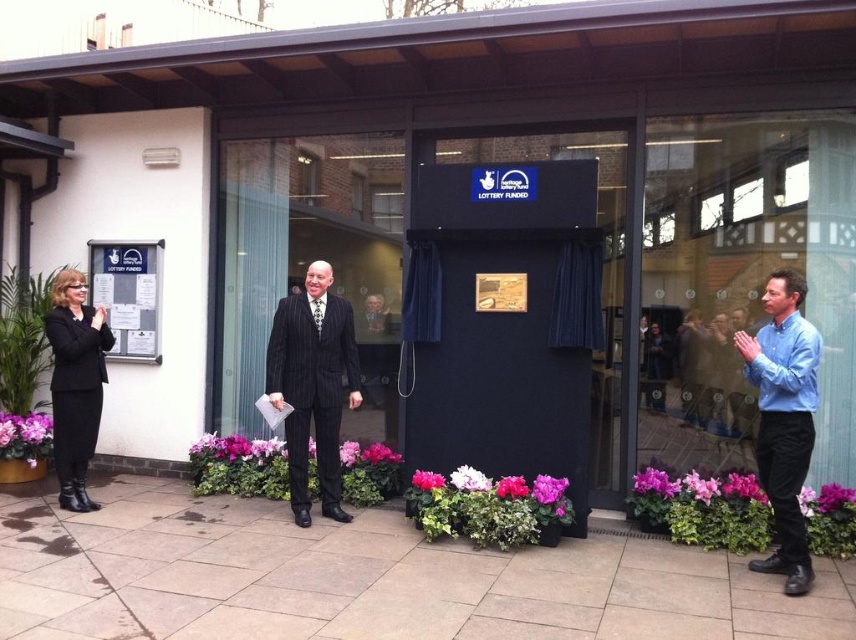
You are a photographer taking a group photo of the blue shirt at right and the black leather jacket at left. Which person should you position closer to the camera to ensure both are in focus?

The blue shirt at right is much taller than the black leather jacket at left, so to ensure both are in focus, position the black leather jacket at left closer to the camera since it is shorter and needs to be brought into the same focal plane as the taller individual.

You are a photographer standing at the edge of the paved area. You want to take a photo of the pinstriped suit at center so that it is centered in the frame. Given that your camera has a field of view of 60 degrees horizontally, can you estimate whether the pinstriped suit at center will fit entirely within the frame if you position yourself directly facing the point represented by point (313, 385)?

The pinstriped suit at center is represented by point (313, 385), so positioning the camera directly facing this point would center it in the frame. The field of view of 60 degrees would allow the pinstriped suit at center to fit within the frame as long as the distance from the camera to the point is sufficient to encompass the subject within the 60 degree angle.

You are attending an event at the building and need to find the main speaker. The main speaker is the person who is positioned in front of the other attendees. Are you able to see the pinstriped suit at center in front of the black leather jacket at left?

Yes, the pinstriped suit at center is positioned over the black leather jacket at left, meaning the pinstriped suit at center is in front and is likely the main speaker.